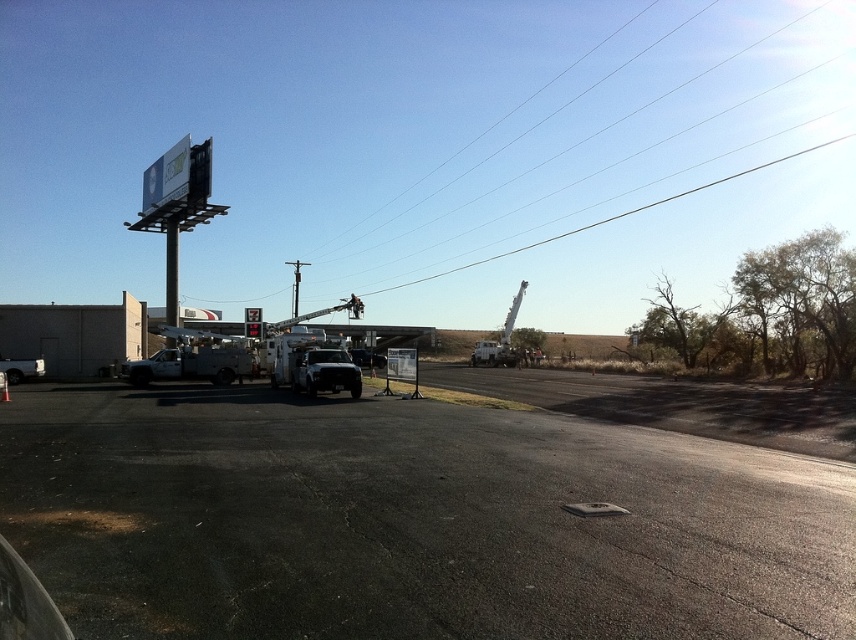
Locate an element on the screen. This screenshot has width=856, height=640. white matte utility truck at center is located at coordinates (313, 364).

Is point (283, 362) closer to viewer compared to point (229, 346)?

Yes, it is in front of point (229, 346).

Find the location of a particular element. The width and height of the screenshot is (856, 640). white matte utility truck at center is located at coordinates (313, 364).

Which is more to the left, clear wire at upper center or brushed metal pole at left?

brushed metal pole at left is more to the left.

Is point (741, 52) positioned before point (177, 241)?

No.

At what (x,y) coordinates should I click in order to perform the action: click on clear wire at upper center. Please return your answer as a coordinate pair (x, y). The height and width of the screenshot is (640, 856). Looking at the image, I should click on (601, 128).

Who is positioned more to the left, clear wire at upper center or white matte utility truck at left?

Positioned to the left is white matte utility truck at left.

Between clear wire at upper center and white matte utility truck at left, which one has less height?

Standing shorter between the two is white matte utility truck at left.

Which is behind, point (479, 163) or point (254, 374)?

Positioned behind is point (479, 163).

The height and width of the screenshot is (640, 856). I want to click on clear wire at upper center, so click(601, 128).